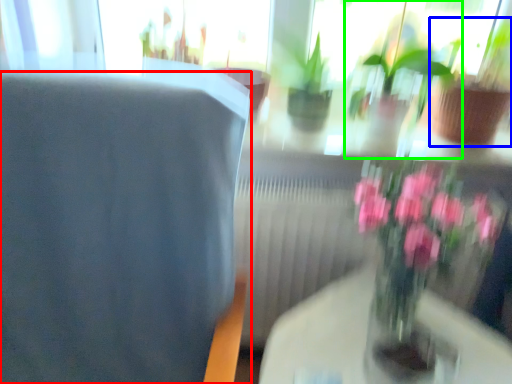
Question: Based on their relative distances, which object is nearer to chair (highlighted by a red box)? Choose from houseplant (highlighted by a blue box) and houseplant (highlighted by a green box).

Choices:
 (A) houseplant
 (B) houseplant

Answer: (B)